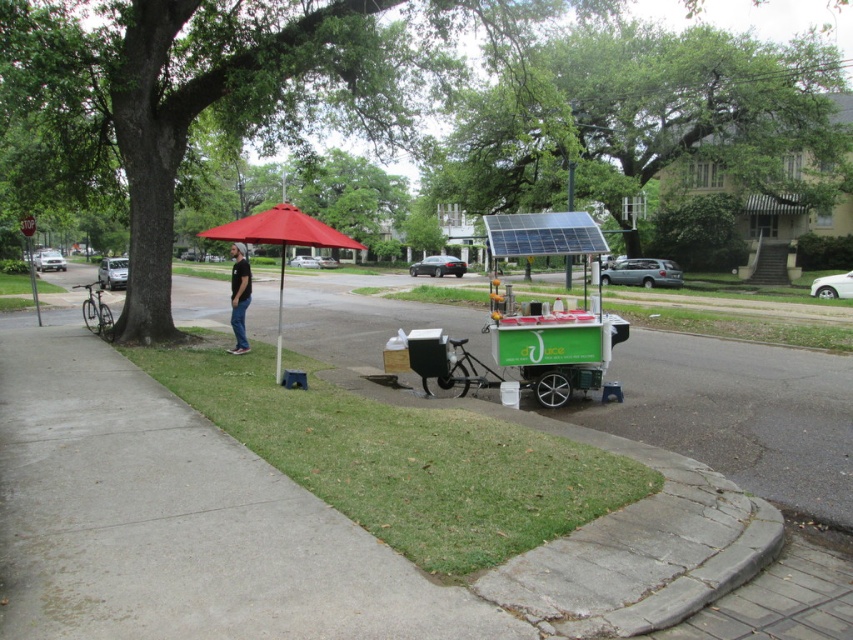
Which is above, red fabric umbrella at center or black cotton shirt at center?

red fabric umbrella at center is higher up.

Can you confirm if red fabric umbrella at center is positioned above black cotton shirt at center?

Correct, red fabric umbrella at center is located above black cotton shirt at center.

Does point (334, 234) come in front of point (235, 300)?

Yes, it is in front of point (235, 300).

At what (x,y) coordinates should I click in order to perform the action: click on red fabric umbrella at center. Please return your answer as a coordinate pair (x, y). Looking at the image, I should click on (281, 240).